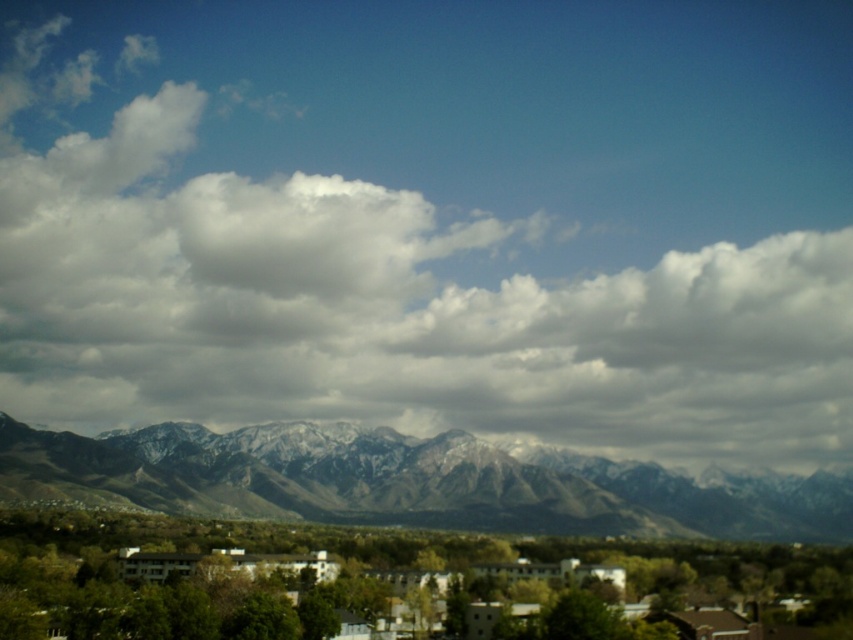
Does white fluffy cloud at upper center appear over green matte buildings at center?

Correct, white fluffy cloud at upper center is located above green matte buildings at center.

Does white fluffy cloud at upper center appear on the right side of green matte buildings at center?

Incorrect, white fluffy cloud at upper center is not on the right side of green matte buildings at center.

The image size is (853, 640). What are the coordinates of `white fluffy cloud at upper center` in the screenshot? It's located at (434, 221).

This screenshot has height=640, width=853. What are the coordinates of `white fluffy cloud at upper center` in the screenshot? It's located at (434, 221).

Can you confirm if white fluffy cloud at upper center is smaller than snowy rock mountain range at center?

No, white fluffy cloud at upper center is not smaller than snowy rock mountain range at center.

Who is shorter, white fluffy cloud at upper center or snowy rock mountain range at center?

Standing shorter between the two is snowy rock mountain range at center.

Is point (746, 435) positioned after point (532, 458)?

Yes, it is.

Where is `white fluffy cloud at upper center`? This screenshot has width=853, height=640. white fluffy cloud at upper center is located at coordinates (434, 221).

Describe the element at coordinates (386, 582) in the screenshot. The image size is (853, 640). I see `green matte buildings at center` at that location.

This screenshot has height=640, width=853. Describe the element at coordinates (386, 582) in the screenshot. I see `green matte buildings at center` at that location.

I want to click on green matte buildings at center, so click(386, 582).